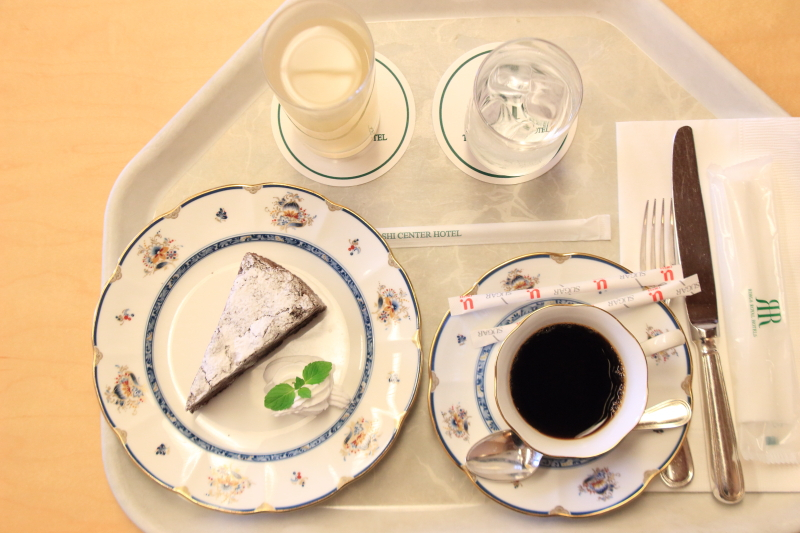
Locate an element on the screen. cup is located at coordinates (509, 413).